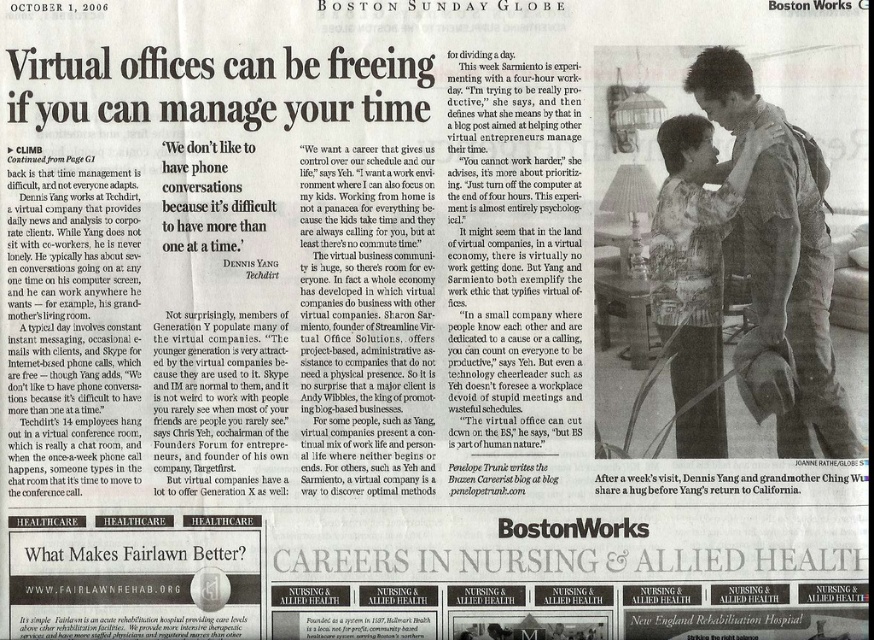
Is light brown leather jacket at upper right in front of light brown textured shirt at upper right?

That is True.

Who is lower down, light brown leather jacket at upper right or light brown textured shirt at upper right?

light brown textured shirt at upper right is lower down.

Who is more forward, (800, 209) or (718, 422)?

Positioned in front is point (800, 209).

Where is `light brown leather jacket at upper right`? The width and height of the screenshot is (874, 640). light brown leather jacket at upper right is located at coordinates (796, 294).